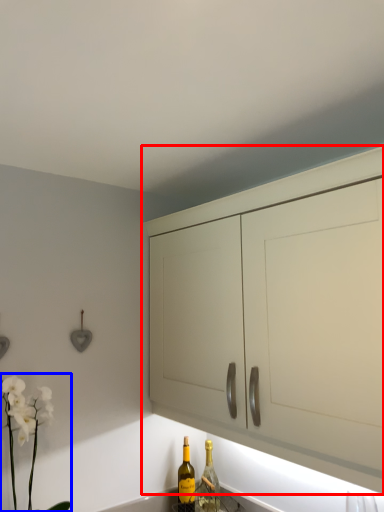
Question: Which of the following is the farthest to the observer, cabinetry (highlighted by a red box) or floral arrangement (highlighted by a blue box)?

Choices:
 (A) cabinetry
 (B) floral arrangement

Answer: (B)